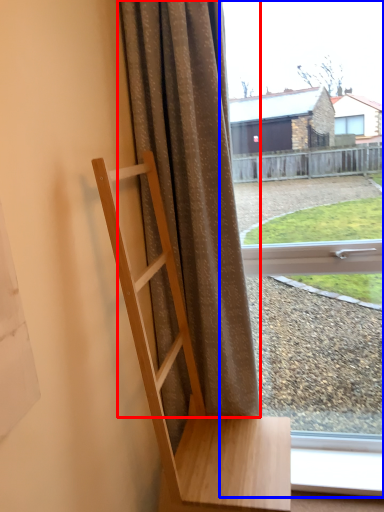
Question: Which object is further to the camera taking this photo, curtain (highlighted by a red box) or window (highlighted by a blue box)?

Choices:
 (A) curtain
 (B) window

Answer: (B)